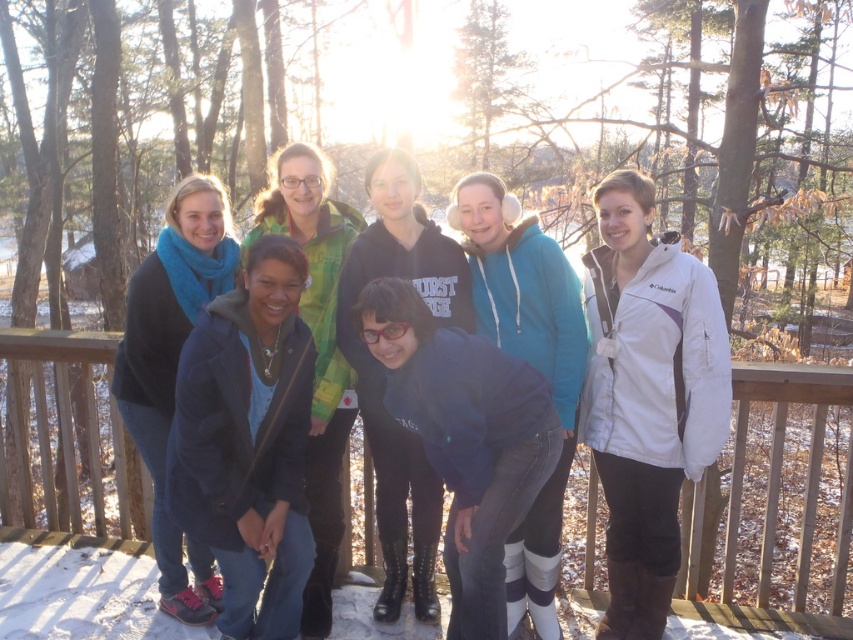
You are standing on the wooden deck surrounded by trees and want to hand out two scarves to the people wearing the dark blue fleece at center and the blue fleece jacket at left. Which person should you approach first if you want to give the scarf to the one lower in position?

The dark blue fleece at center is located below the blue fleece jacket at left, so you should approach the person wearing the dark blue fleece at center first since they are lower.

You are a photographer standing 1.5 meters away from the camera. You want to pick up the dark blue fleece at center without moving the camera. Is it possible to reach the fleece while staying in your current position?

The dark blue fleece at center and camera are 2.85 meters apart. Since you are only 1.5 meters away from the camera, the fleece is 2.85 meters away from you, so you cannot reach it without moving closer.